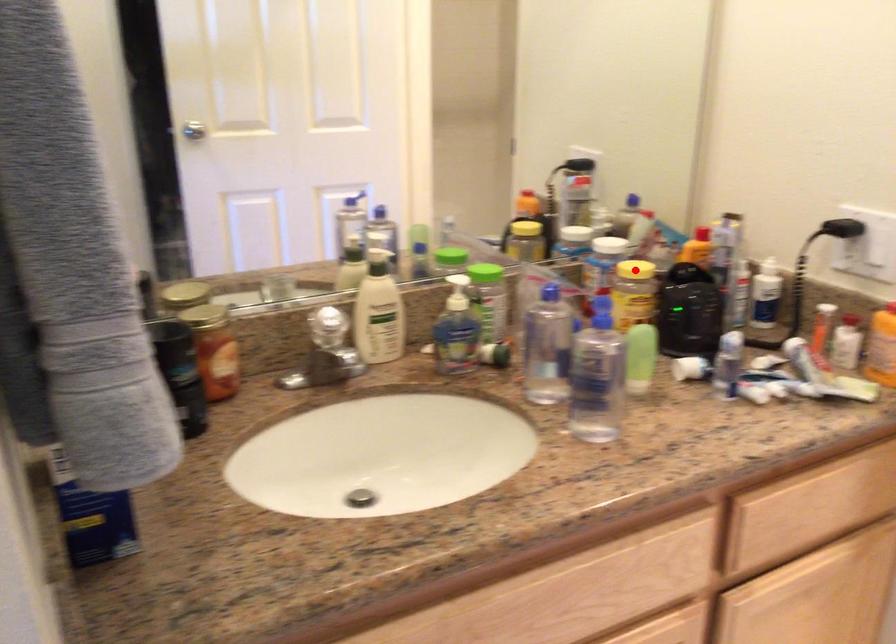
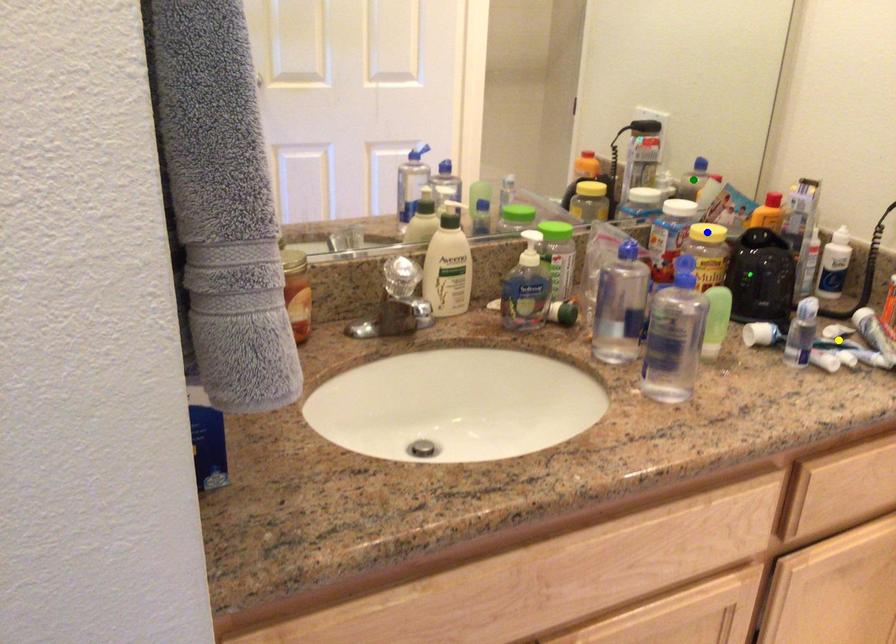
Question: I am providing you with two images of the same scene from different viewpoints. A red point is marked on the first image. You are given multiple points on the second image. Which point in image 2 is actually the same real-world point as the red point in image 1?

Choices:
 (A) green point
 (B) yellow point
 (C) blue point

Answer: (C)